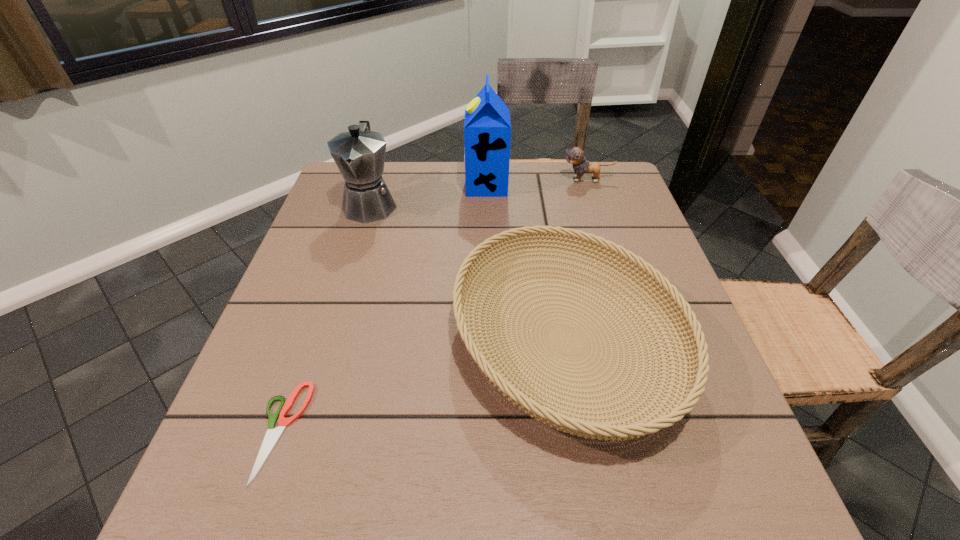
Locate an element on the screen. The width and height of the screenshot is (960, 540). kitten that is at the right edge is located at coordinates (575, 156).

I want to click on basket at the right edge, so click(695, 371).

Identify the location of object present at the far left corner. (359, 154).

At what (x,y) coordinates should I click in order to perform the action: click on object present at the near left corner. Please return your answer as a coordinate pair (x, y). The width and height of the screenshot is (960, 540). Looking at the image, I should click on (272, 435).

I want to click on object located in the far right corner section of the desktop, so pyautogui.click(x=575, y=156).

Locate an element on the screen. vacant space at the far edge is located at coordinates (554, 184).

You are a GUI agent. You are given a task and a screenshot of the screen. Output one action in this format:
    pyautogui.click(x=<x>, y=<y>)
    Task: Click on the vacant space at the near edge of the desktop
    The width and height of the screenshot is (960, 540).
    Given the screenshot: What is the action you would take?
    pyautogui.click(x=564, y=469)

At what (x,y) coordinates should I click in order to perform the action: click on vacant area at the left edge of the desktop. Please return your answer as a coordinate pair (x, y). Looking at the image, I should click on (342, 308).

Image resolution: width=960 pixels, height=540 pixels. In the image, there is a desktop. Find the location of `vacant space at the right edge`. vacant space at the right edge is located at coordinates (586, 215).

Where is `vacant space at the near left corner`? Image resolution: width=960 pixels, height=540 pixels. vacant space at the near left corner is located at coordinates (256, 484).